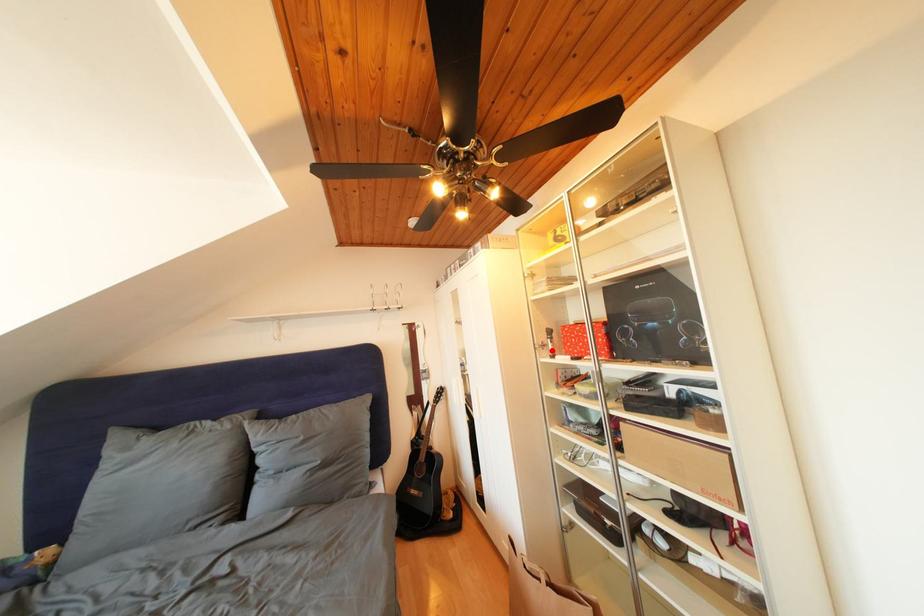
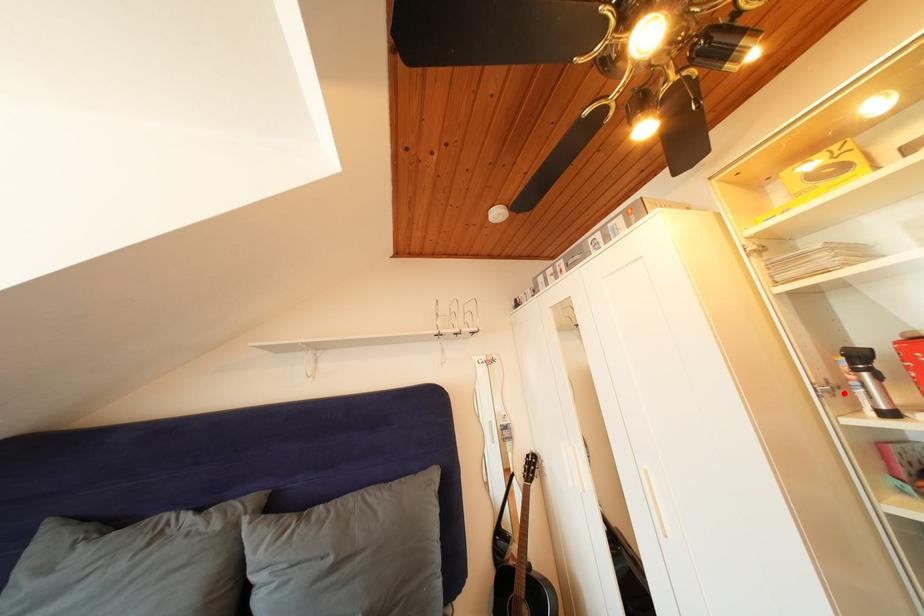
I am providing you with two images of the same scene from different viewpoints. A red point is marked on the first image and another point is marked on the second image. Is the marked point in image1 the same physical position as the marked point in image2?

Yes